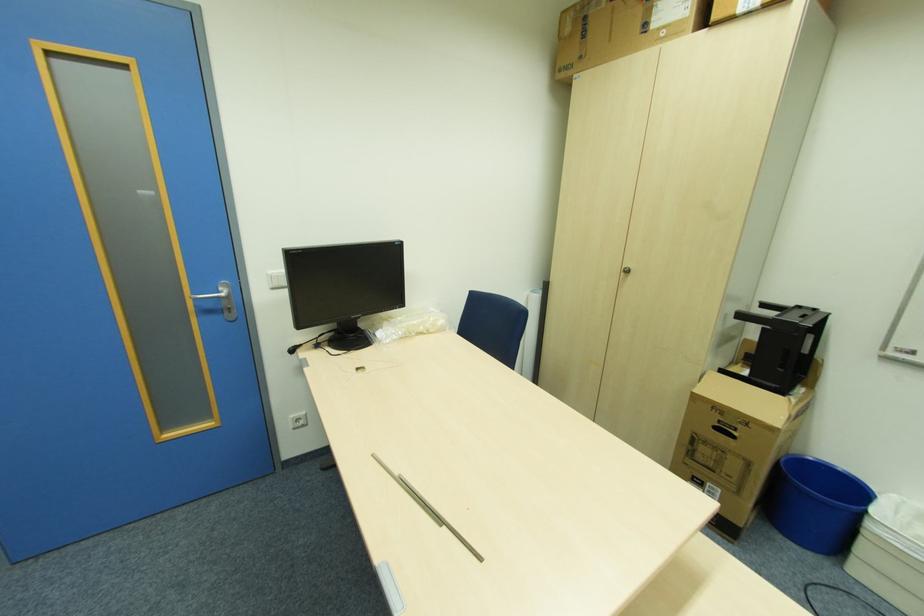
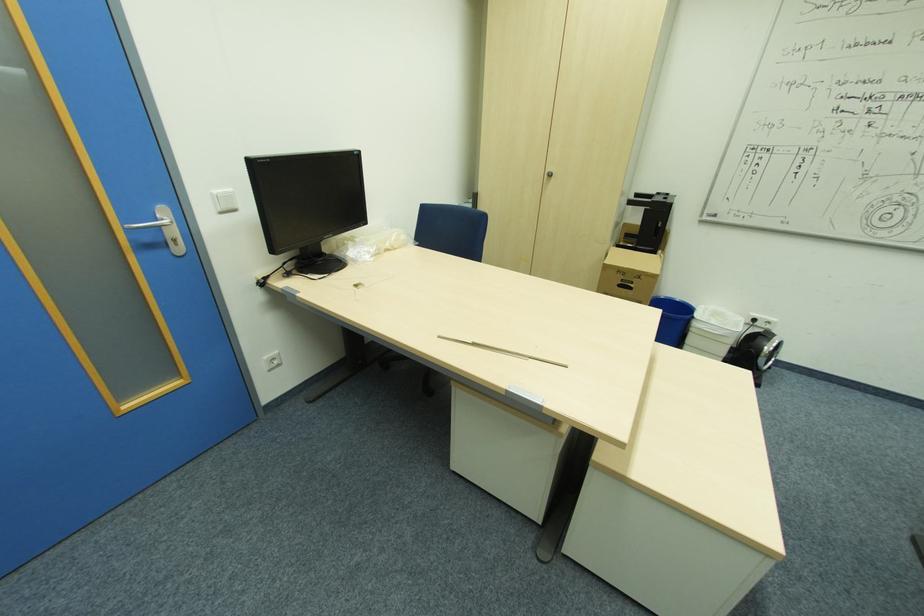
In the second image, find the point that corresponds to pixel 748 424 in the first image.

(641, 277)